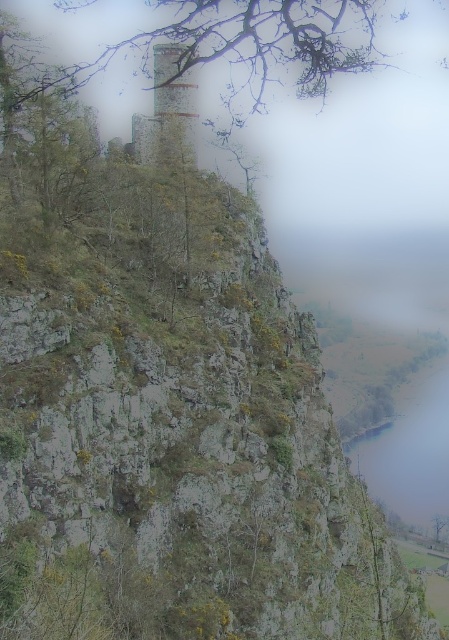
Question: Is bare branches at upper center smaller than rustic stone tower at center?

Choices:
 (A) yes
 (B) no

Answer: (B)

Question: Is bare branches at upper center thinner than rustic stone tower at center?

Choices:
 (A) yes
 (B) no

Answer: (B)

Question: Can you confirm if bare branches at upper center is smaller than rustic stone tower at center?

Choices:
 (A) no
 (B) yes

Answer: (A)

Question: Which object appears farthest from the camera in this image?

Choices:
 (A) bare branches at upper center
 (B) rustic stone tower at center

Answer: (B)